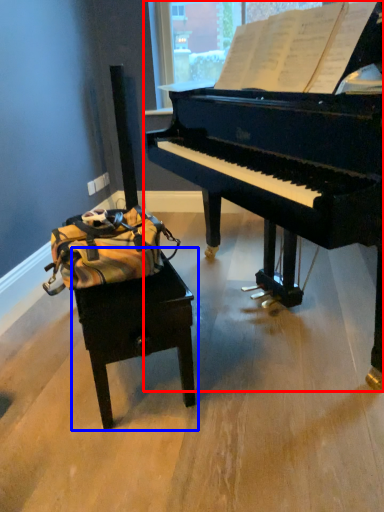
Question: Which object appears farthest to the camera in this image, piano (highlighted by a red box) or table (highlighted by a blue box)?

Choices:
 (A) piano
 (B) table

Answer: (B)